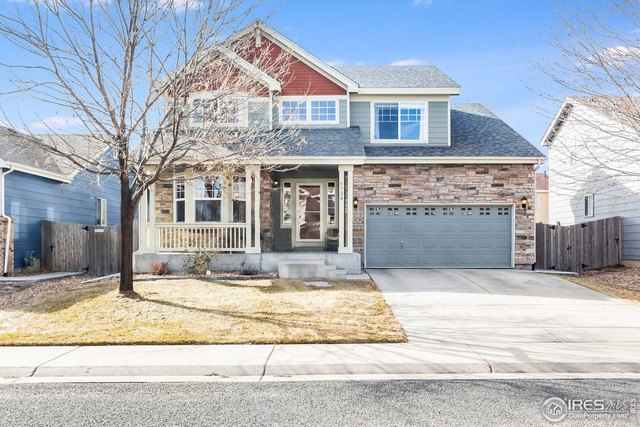
Where is `window`? The height and width of the screenshot is (427, 640). window is located at coordinates (406, 124), (324, 112), (202, 191).